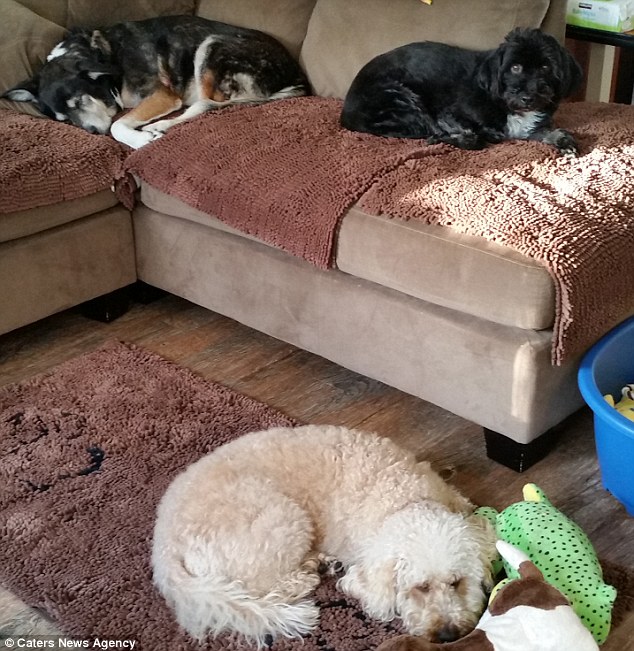
This screenshot has width=634, height=651. In order to click on toy in this screenshot , I will do `click(570, 549)`, `click(537, 616)`, `click(617, 411)`.